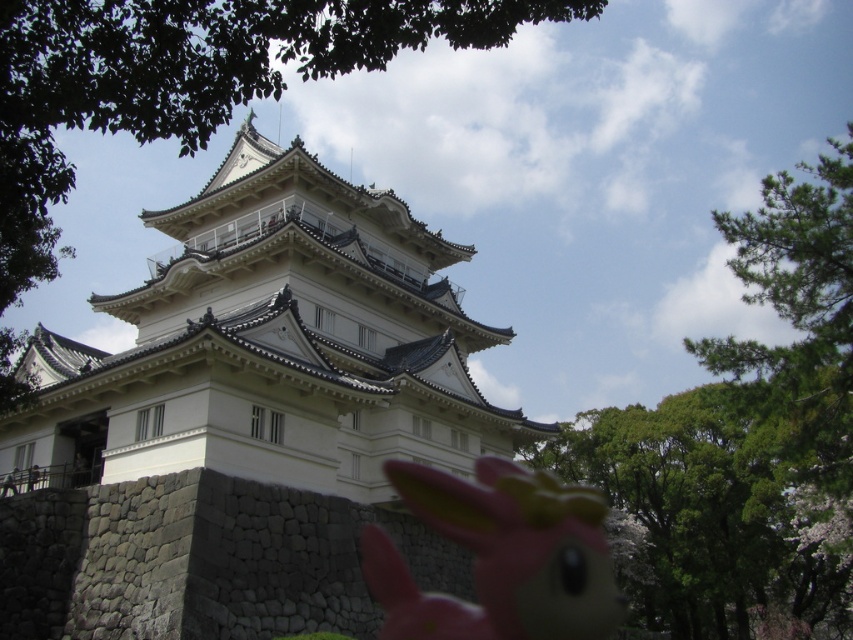
You are a visitor to the castle and notice both the green leafy tree at upper center and the pink rubber toy at center. Which object appears larger in the image?

The green leafy tree at upper center appears larger than the pink rubber toy at center because it is taller.